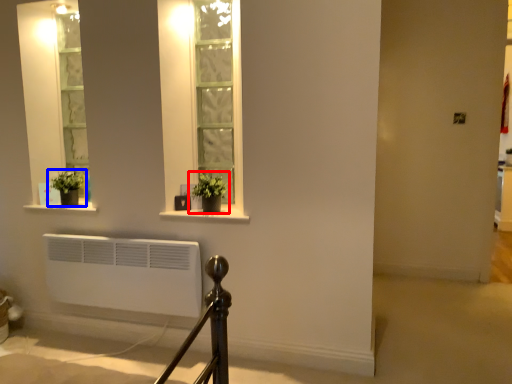
Question: Which point is closer to the camera, houseplant (highlighted by a red box) or houseplant (highlighted by a blue box)?

Choices:
 (A) houseplant
 (B) houseplant

Answer: (A)